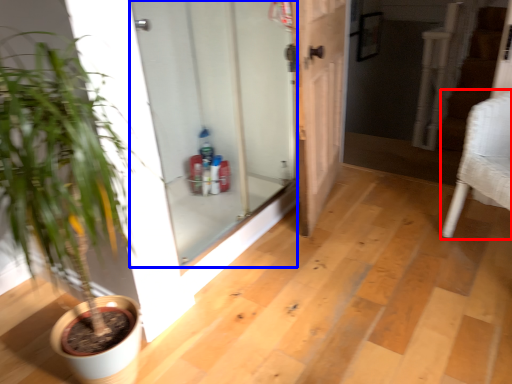
Question: Which point is closer to the camera, armchair (highlighted by a red box) or door (highlighted by a blue box)?

Choices:
 (A) armchair
 (B) door

Answer: (B)